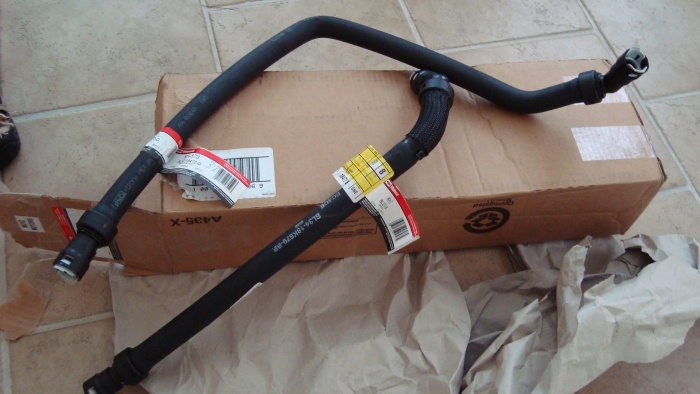
The image size is (700, 394). Find the location of `grout line`. grout line is located at coordinates (120, 96), (214, 35).